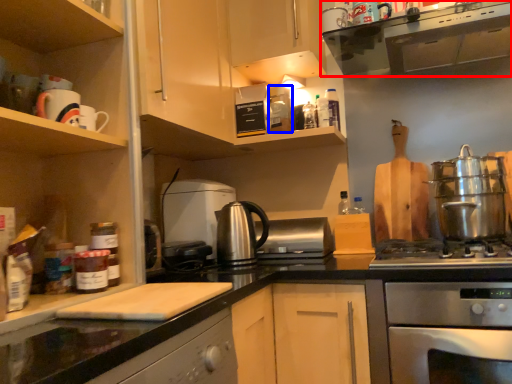
Question: Among these objects, which one is farthest to the camera, home appliance (highlighted by a red box) or appliance (highlighted by a blue box)?

Choices:
 (A) home appliance
 (B) appliance

Answer: (B)